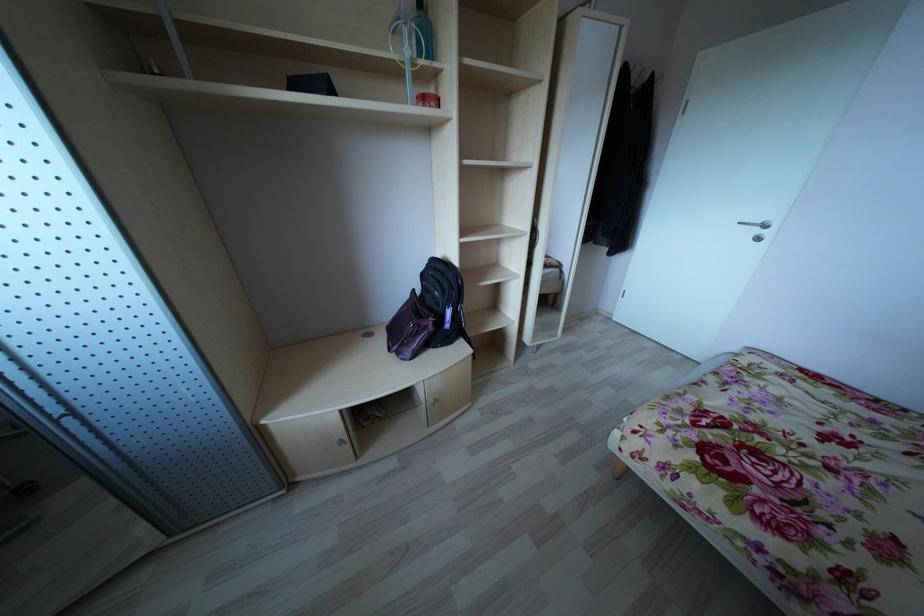
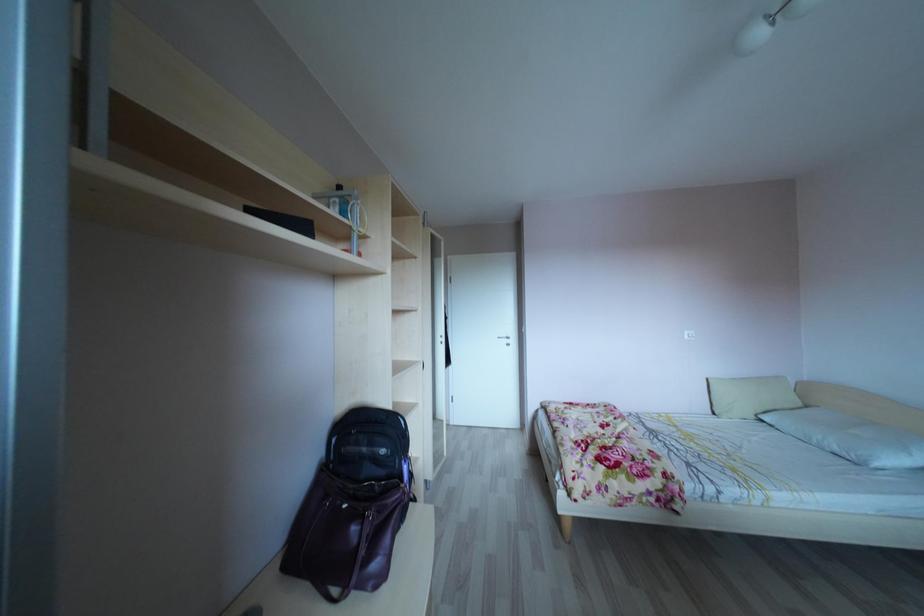
Based on the continuous images, in which direction is the camera rotating?

The camera rotated toward right-up.